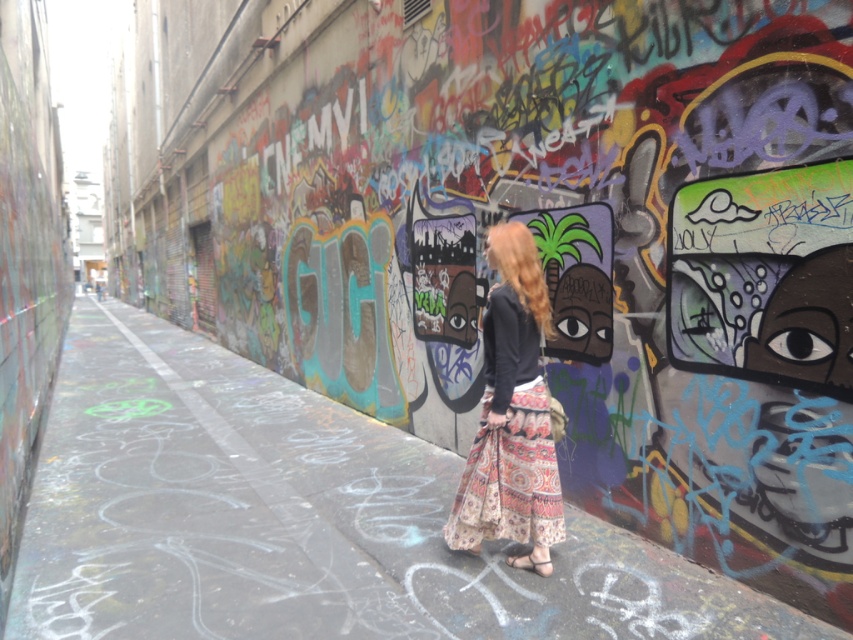
Does matte concrete alley at center have a lesser width compared to printed cotton skirt at center?

No.

Who is more forward, [364,557] or [498,406]?

Point [498,406]

Is point (166, 371) closer to camera compared to point (500, 385)?

No.

Find the location of a particular element. The width and height of the screenshot is (853, 640). matte concrete alley at center is located at coordinates (299, 518).